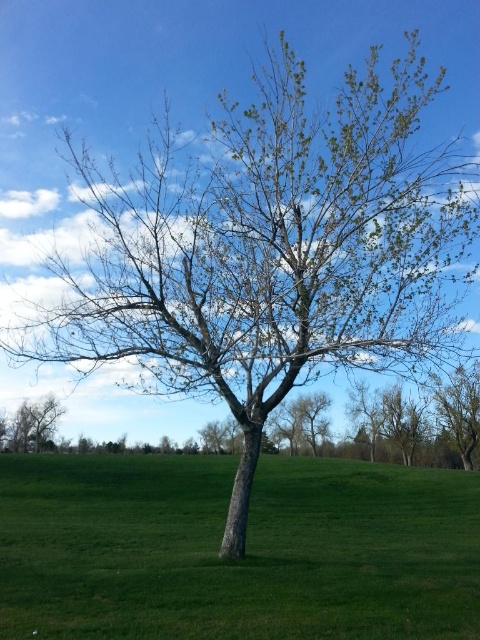
You are standing in the field and see the green grass at center and the green matte tree at lower left. Which object is positioned to the right of the other?

The green grass at center is to the right of green matte tree at lower left.

You are standing in the field and want to walk towards the green grass at center and the green matte tree at lower left. Which one will you reach first?

You will reach the green grass at center first because it is closer to you than the green matte tree at lower left.

Please provide the 2D coordinates of the green grass at center in the image, using the coordinate system where the bottom left corner is the origin point.

The 2D coordinates of the green grass at center are at point (244, 556).